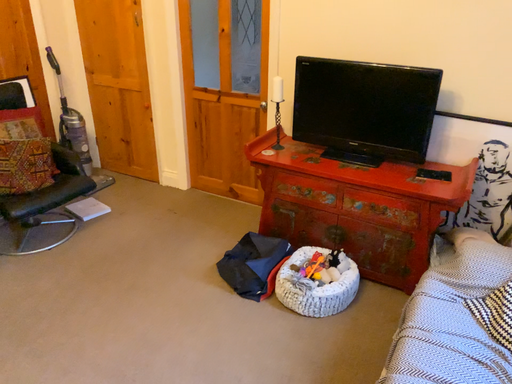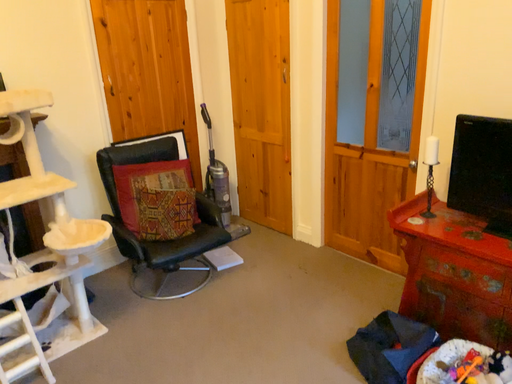
Question: How did the camera likely rotate when shooting the video?

Choices:
 (A) rotated downward
 (B) rotated upward

Answer: (B)